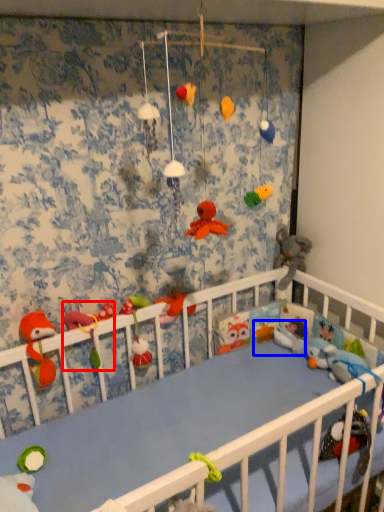
Question: Among these objects, which one is nearest to the camera, toy (highlighted by a red box) or toy (highlighted by a blue box)?

Choices:
 (A) toy
 (B) toy

Answer: (A)